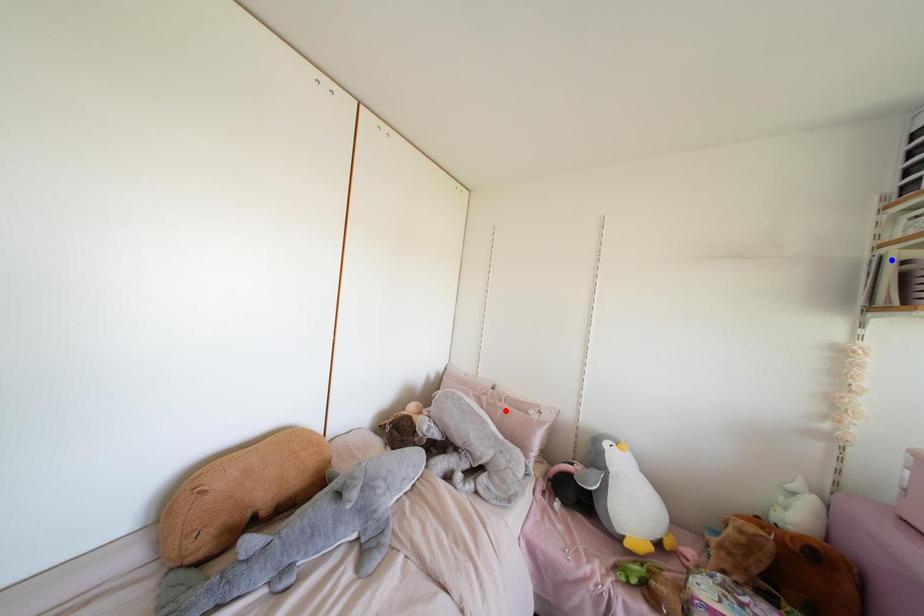
Question: Two points are marked on the image. Which point is closer to the camera?

Choices:
 (A) Blue point is closer.
 (B) Red point is closer.

Answer: (A)